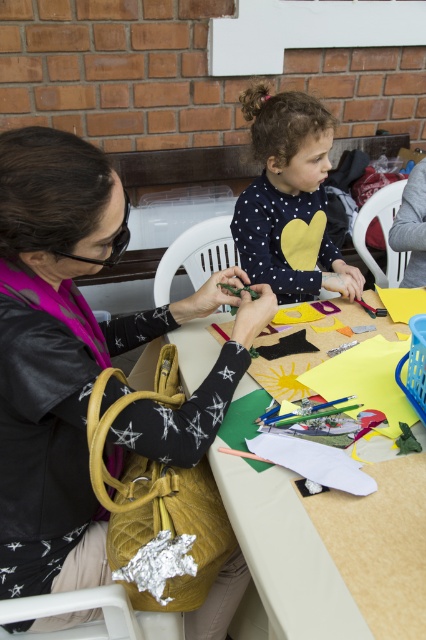
Who is shorter, quilted yellow purse at center or matte brown table at center?

matte brown table at center

Can you confirm if quilted yellow purse at center is thinner than matte brown table at center?

No, quilted yellow purse at center is not thinner than matte brown table at center.

Locate an element on the screen. The height and width of the screenshot is (640, 426). quilted yellow purse at center is located at coordinates (x=81, y=358).

Who is lower down, matte brown table at center or polka dot sweater at center?

matte brown table at center is below.

You are a GUI agent. You are given a task and a screenshot of the screen. Output one action in this format:
    pyautogui.click(x=<x>, y=<y>)
    Task: Click on the matte brown table at center
    
    Given the screenshot: What is the action you would take?
    pyautogui.click(x=331, y=548)

Where is `matte brown table at center`? The width and height of the screenshot is (426, 640). matte brown table at center is located at coordinates (331, 548).

Is quilted yellow purse at center to the left of polka dot sweater at center from the viewer's perspective?

Indeed, quilted yellow purse at center is positioned on the left side of polka dot sweater at center.

Which is behind, point (60, 278) or point (331, 144)?

Point (331, 144)

Find the location of a particular element. This screenshot has width=426, height=640. quilted yellow purse at center is located at coordinates (81, 358).